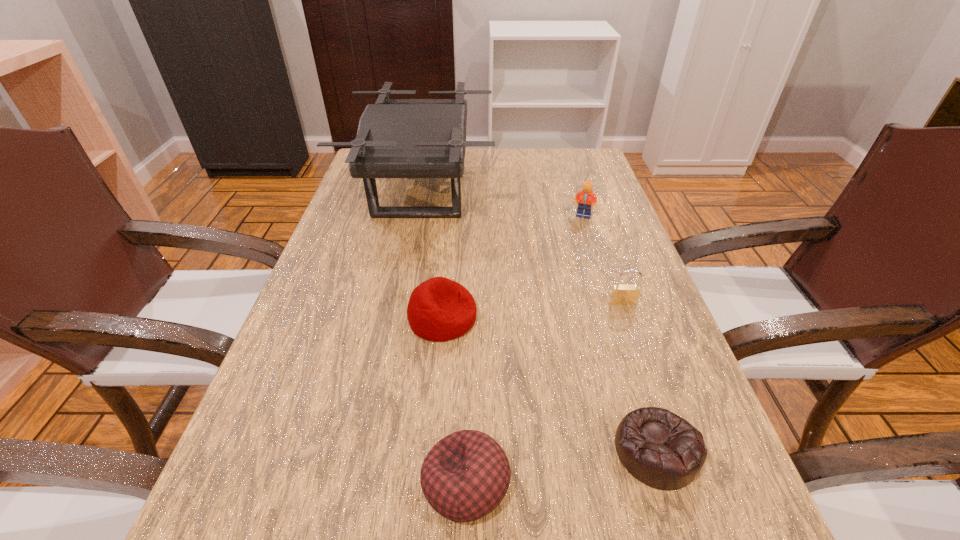
At what (x,y) coordinates should I click in order to perform the action: click on vacant point located between the rightmost beanbag and the farthest beanbag. Please return your answer as a coordinate pair (x, y). Image resolution: width=960 pixels, height=540 pixels. Looking at the image, I should click on (549, 384).

The width and height of the screenshot is (960, 540). I want to click on free area in between the Lego and the farthest beanbag, so click(x=513, y=267).

Find the location of a particular element. empty location between the padlock and the Lego is located at coordinates (603, 259).

The width and height of the screenshot is (960, 540). In order to click on vacant point located between the tallest object and the rightmost beanbag in this screenshot , I will do `click(539, 321)`.

The width and height of the screenshot is (960, 540). In order to click on free space that is in between the farthest beanbag and the Lego in this screenshot , I will do `click(513, 267)`.

Choose which object is the third nearest neighbor to the rightmost beanbag. Please provide its 2D coordinates. Your answer should be formatted as a tuple, i.e. [(x, y)], where the tuple contains the x and y coordinates of a point satisfying the conditions above.

[(439, 309)]

Identify which object is located as the third nearest to the shortest object. Please provide its 2D coordinates. Your answer should be formatted as a tuple, i.e. [(x, y)], where the tuple contains the x and y coordinates of a point satisfying the conditions above.

[(439, 309)]

Locate which beanbag ranks in proximity to the Lego. Please provide its 2D coordinates. Your answer should be formatted as a tuple, i.e. [(x, y)], where the tuple contains the x and y coordinates of a point satisfying the conditions above.

[(439, 309)]

Select which beanbag is the second closest to the farthest beanbag. Please provide its 2D coordinates. Your answer should be formatted as a tuple, i.e. [(x, y)], where the tuple contains the x and y coordinates of a point satisfying the conditions above.

[(662, 450)]

The image size is (960, 540). In order to click on free space that satisfies the following two spatial constraints: 1. with a camera mounted on the underside of the shortest beanbag; 2. on the right side of the tallest object in this screenshot , I will do `click(372, 451)`.